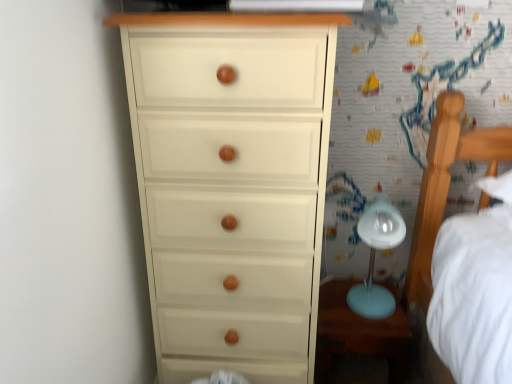
Question: From the image's perspective, is matte blue table at lower right over light blue plastic table lamp at right?

Choices:
 (A) yes
 (B) no

Answer: (B)

Question: Does matte blue table at lower right have a lesser width compared to light blue plastic table lamp at right?

Choices:
 (A) yes
 (B) no

Answer: (B)

Question: Considering the relative positions of matte blue table at lower right and light blue plastic table lamp at right in the image provided, is matte blue table at lower right in front of light blue plastic table lamp at right?

Choices:
 (A) no
 (B) yes

Answer: (A)

Question: Considering the relative positions of matte blue table at lower right and light blue plastic table lamp at right in the image provided, is matte blue table at lower right to the left of light blue plastic table lamp at right from the viewer's perspective?

Choices:
 (A) no
 (B) yes

Answer: (B)

Question: Is matte blue table at lower right outside light blue plastic table lamp at right?

Choices:
 (A) no
 (B) yes

Answer: (B)

Question: In the image, is light blue plastic table lamp at right positioned in front of or behind matte white chest of drawers at left?

Choices:
 (A) behind
 (B) front

Answer: (A)

Question: Is light blue plastic table lamp at right bigger or smaller than matte white chest of drawers at left?

Choices:
 (A) small
 (B) big

Answer: (A)

Question: From the image's perspective, is light blue plastic table lamp at right above or below matte white chest of drawers at left?

Choices:
 (A) above
 (B) below

Answer: (B)

Question: Based on their positions, is light blue plastic table lamp at right located to the left or right of matte white chest of drawers at left?

Choices:
 (A) right
 (B) left

Answer: (A)

Question: Do you think light blue plastic table lamp at right is within matte blue table at lower right, or outside of it?

Choices:
 (A) outside
 (B) inside

Answer: (A)

Question: In terms of height, does light blue plastic table lamp at right look taller or shorter compared to matte blue table at lower right?

Choices:
 (A) short
 (B) tall

Answer: (B)

Question: Considering the relative positions of light blue plastic table lamp at right and matte blue table at lower right in the image provided, is light blue plastic table lamp at right to the left or to the right of matte blue table at lower right?

Choices:
 (A) right
 (B) left

Answer: (A)

Question: Is light blue plastic table lamp at right in front of or behind matte blue table at lower right in the image?

Choices:
 (A) front
 (B) behind

Answer: (A)

Question: Looking at their shapes, would you say matte white chest of drawers at left is wider or thinner than matte blue table at lower right?

Choices:
 (A) thin
 (B) wide

Answer: (B)

Question: Is matte white chest of drawers at left to the left or to the right of matte blue table at lower right in the image?

Choices:
 (A) right
 (B) left

Answer: (B)